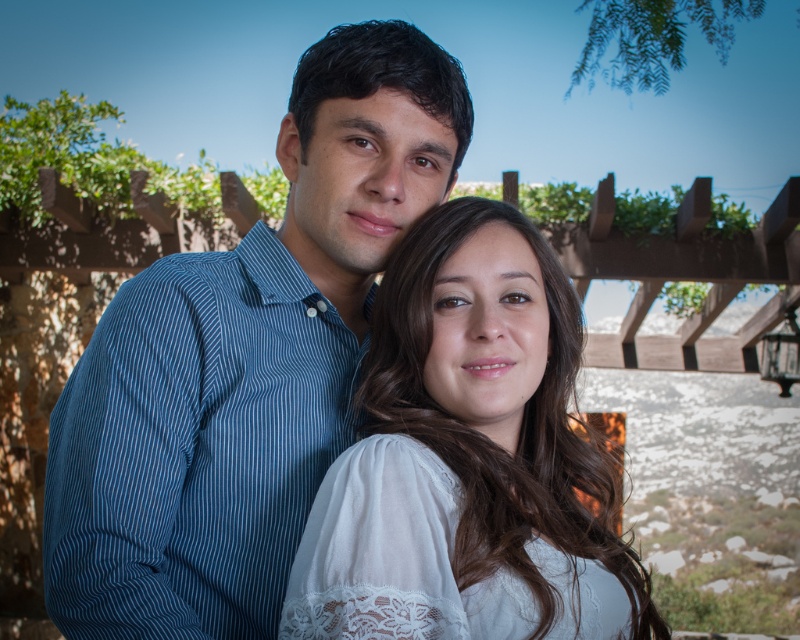
Can you confirm if blue striped shirt at center is thinner than white lace blouse at center?

Incorrect, blue striped shirt at center's width is not less than white lace blouse at center's.

Is blue striped shirt at center above white lace blouse at center?

Indeed, blue striped shirt at center is positioned over white lace blouse at center.

Where is `blue striped shirt at center`? blue striped shirt at center is located at coordinates (244, 362).

What are the coordinates of `blue striped shirt at center` in the screenshot? It's located at (244, 362).